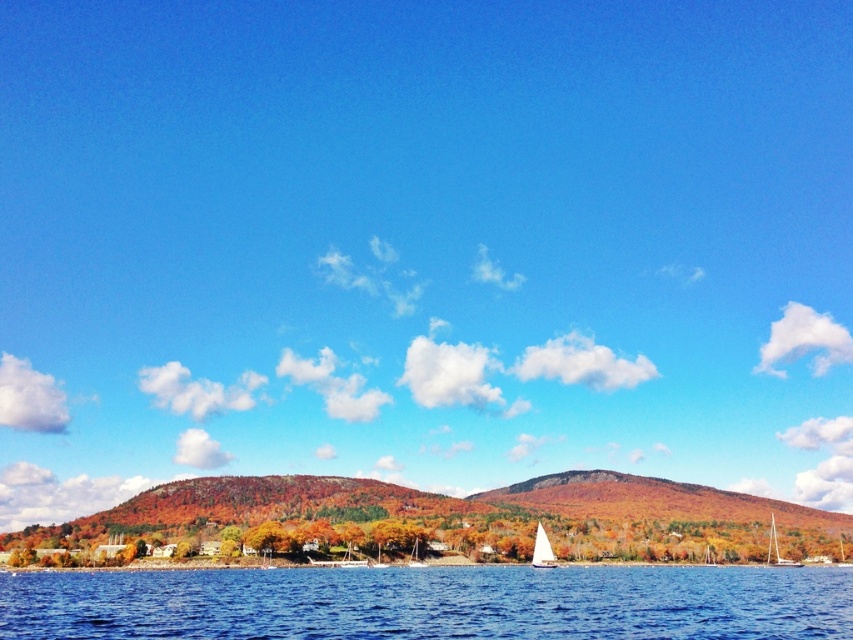
You are standing on the shore and see both the white sailboat at lower center and the white glossy sailboat at lower right. Which one appears closer to you?

The white sailboat at lower center appears closer because it is positioned in front of the white glossy sailboat at lower right.

You are standing on the shore and want to determine which white glossy sailboat is closer to you. The options are the white glossy sailboat at lower right and the white glossy sailboat at center. Which one is closer?

The white glossy sailboat at lower right is closer because it is only 361.93 feet away from the white glossy sailboat at center, making it nearer to the shore where you are standing.

You are standing at the center of the image and want to locate the white glossy sailboat at lower right. According to the coordinates provided, in which direction should you look to find it?

You should look to the lower right direction to find the white glossy sailboat at lower right since it is located at point [776,548].